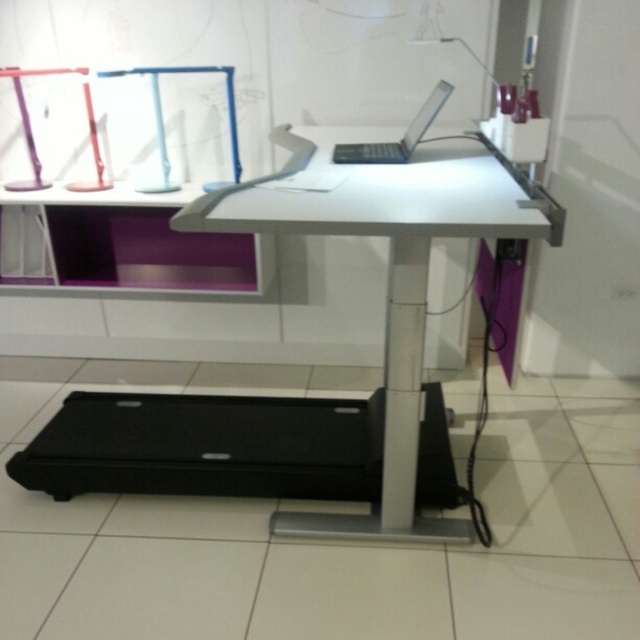
You need to place a new monitor that is the same size as the satin silver laptop at upper center on the white glossy computer desk at center. Will there be enough space?

The white glossy computer desk at center is bigger than the satin silver laptop at upper center, so there will be enough space to place the new monitor of the same size.

You need to place a new monitor that is the same width as the satin silver laptop at upper center on the white glossy computer desk at center. Will the desk be wide enough to accommodate the monitor?

The white glossy computer desk at center is wider than the satin silver laptop at upper center, so the desk will have enough width to accommodate the monitor since the desk is wider than the laptop.

You are setting up a new monitor for your home office. The monitor requires a space to the right of the satin silver laptop at upper center. Is there enough space on the white glossy computer desk at center to place the monitor?

The white glossy computer desk at center is to the left of the satin silver laptop at upper center, so placing a monitor to the right of the laptop would require space beyond the desk. Since the desk is already positioned to the left of the laptop, there might not be sufficient space on the desk itself for the monitor to the right of the laptop.